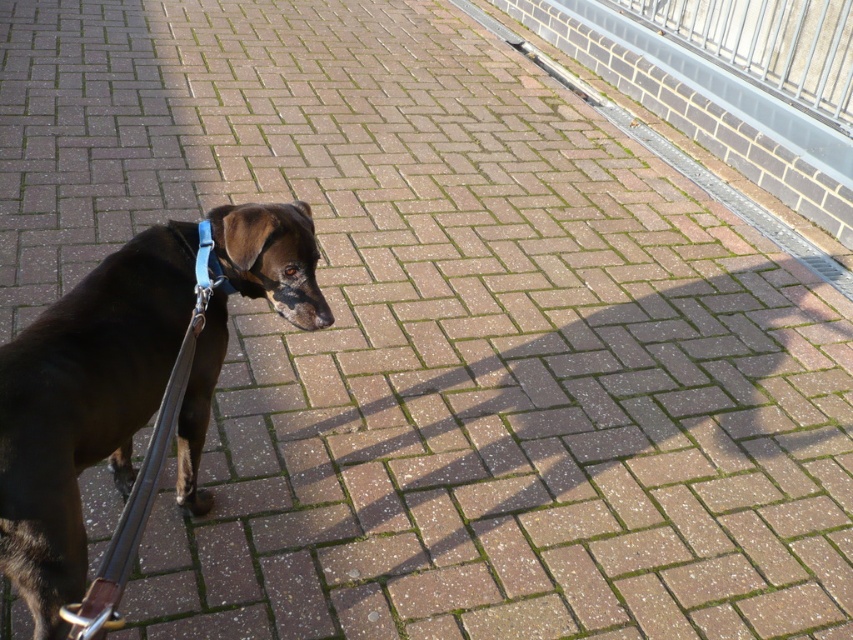
You are a photographer setting up a tripod on the paved brick pathway. The tripod has a maximum width requirement of 30 cm to avoid tipping over. You need to place it either where the black leather dog at left is standing or where the blue fabric strap at center is located. Based on the scene, which location would be safer for the tripod to remain stable?

The black leather dog at left is wider than the blue fabric strap at center. Since the tripod can only handle up to 30 cm width, placing it at the blue fabric strap at center would be safer to ensure stability.

You are a pedestrian walking along the paved brick pathway. You see a black leather dog at left and a blue fabric strap at center. Which object is closer to you?

The black leather dog at left is closer to you since it is positioned in front of the blue fabric strap at center.

Consider the image. You are walking your dog and see the black leather dog at left and the blue fabric strap at center. Which object is closer to the left edge of the path?

The black leather dog at left is closer to the left edge of the path because it is positioned on the left side of the blue fabric strap at center.